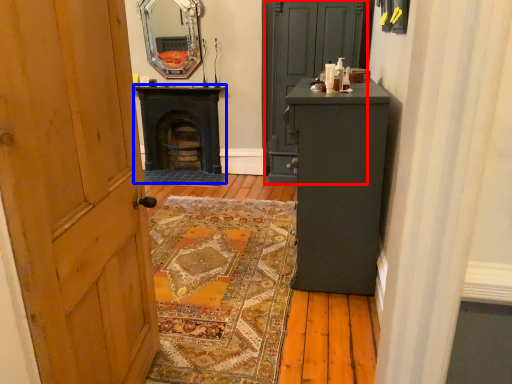
Question: Which object is further to the camera taking this photo, door (highlighted by a red box) or stove (highlighted by a blue box)?

Choices:
 (A) door
 (B) stove

Answer: (B)